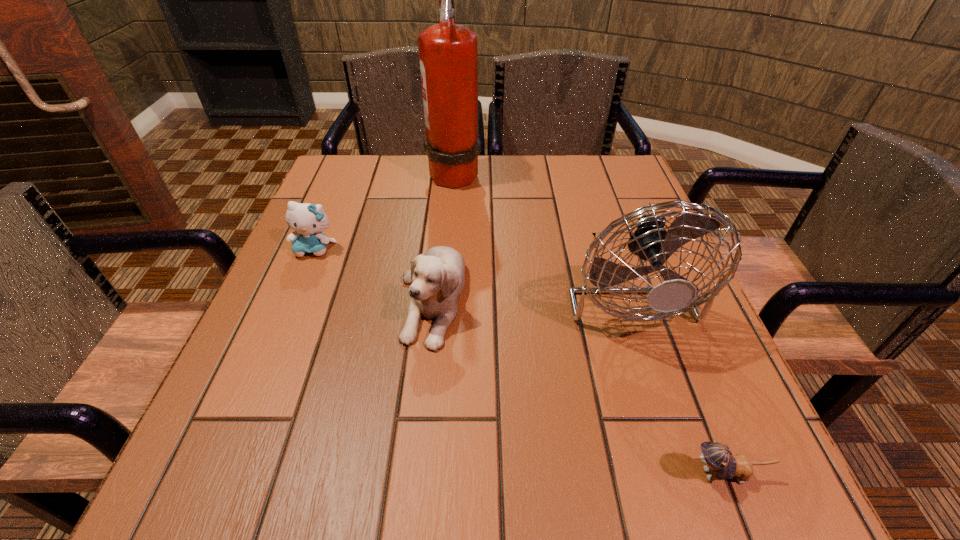
Locate an element on the screen. The image size is (960, 540). the tallest object is located at coordinates click(x=448, y=53).

Identify the location of the farthest object. Image resolution: width=960 pixels, height=540 pixels. (448, 53).

Identify the location of fan. click(x=650, y=241).

Image resolution: width=960 pixels, height=540 pixels. In order to click on puppy in this screenshot , I will do `click(436, 279)`.

In order to click on the farther kitten in this screenshot , I will do `click(308, 221)`.

Where is `the left kitten`? The width and height of the screenshot is (960, 540). the left kitten is located at coordinates (308, 221).

The image size is (960, 540). I want to click on the shorter kitten, so click(x=718, y=459).

Locate an element on the screen. the right kitten is located at coordinates (718, 459).

The height and width of the screenshot is (540, 960). I want to click on free space located at the nozzle of the fire extinguisher, so click(529, 172).

At what (x,y) coordinates should I click in order to perform the action: click on vacant space located on the front-facing side of the fan. Please return your answer as a coordinate pair (x, y). Looking at the image, I should click on (697, 502).